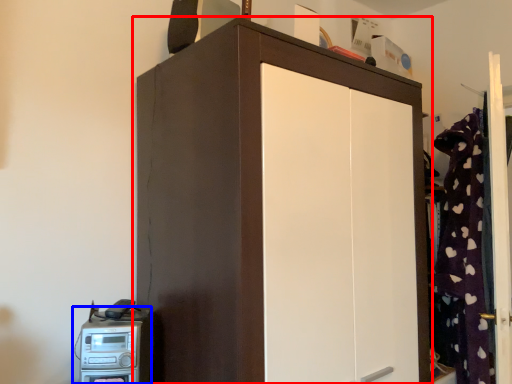
Question: Which point is further to the camera, cupboard (highlighted by a red box) or home appliance (highlighted by a blue box)?

Choices:
 (A) cupboard
 (B) home appliance

Answer: (B)